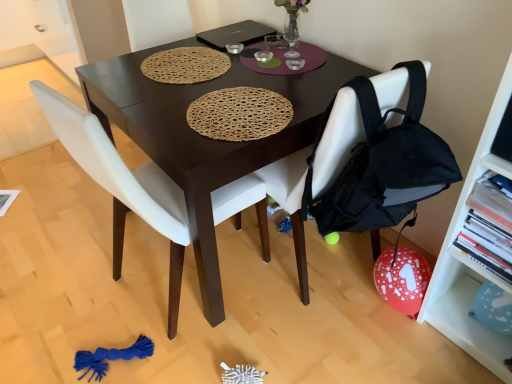
Identify the location of vacant space that is to the left of white matte chair at center, arranged as the 2th chair when viewed from the right. (73, 279).